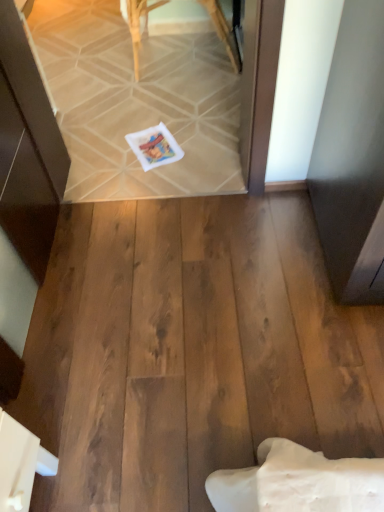
This screenshot has height=512, width=384. I want to click on white matte postcard at center, so click(x=154, y=146).

Image resolution: width=384 pixels, height=512 pixels. Describe the element at coordinates (154, 146) in the screenshot. I see `white matte postcard at center` at that location.

Measure the distance between point (x=226, y=48) and camera.

Point (x=226, y=48) and camera are 2.39 meters apart.

Consider the image. Measure the distance between wooden chair at upper center and camera.

The distance of wooden chair at upper center from camera is 7.65 feet.

Locate an element on the screen. The width and height of the screenshot is (384, 512). wooden chair at upper center is located at coordinates (138, 22).

What do you see at coordinates (138, 22) in the screenshot? The image size is (384, 512). I see `wooden chair at upper center` at bounding box center [138, 22].

At what (x,y) coordinates should I click in order to perform the action: click on white matte postcard at center. Please return your answer as a coordinate pair (x, y). The height and width of the screenshot is (512, 384). Looking at the image, I should click on (154, 146).

Is white matte postcard at center to the right of wooden chair at upper center from the viewer's perspective?

No.

Which object is further away from the camera, white matte postcard at center or wooden chair at upper center?

wooden chair at upper center.

Is point (167, 130) less distant than point (211, 10)?

Yes, it is.

From the image's perspective, is white matte postcard at center under wooden chair at upper center?

Yes, from the image's perspective, white matte postcard at center is beneath wooden chair at upper center.

From a real-world perspective, is white matte postcard at center above or below wooden chair at upper center?

In terms of real-world spatial position, white matte postcard at center is below wooden chair at upper center.

Considering the relative sizes of white matte postcard at center and wooden chair at upper center in the image provided, is white matte postcard at center thinner than wooden chair at upper center?

Yes.

Which of these two, white matte postcard at center or wooden chair at upper center, stands shorter?

white matte postcard at center.

In terms of size, does white matte postcard at center appear bigger or smaller than wooden chair at upper center?

Considering their sizes, white matte postcard at center takes up less space than wooden chair at upper center.

Is wooden chair at upper center inside white matte postcard at center?

Definitely not — wooden chair at upper center is not inside white matte postcard at center.

Is white matte postcard at center far from wooden chair at upper center?

That's not correct — white matte postcard at center is a little close to wooden chair at upper center.

Is white matte postcard at center oriented away from wooden chair at upper center?

That's not correct — white matte postcard at center is not looking away from wooden chair at upper center.

How many degrees apart are the facing directions of white matte postcard at center and wooden chair at upper center?

They differ by 21.6 degrees in their facing directions.

This screenshot has width=384, height=512. I want to click on postcard in front of the wooden chair at upper center, so click(154, 146).

Visually, is wooden chair at upper center positioned to the left or to the right of white matte postcard at center?

wooden chair at upper center is positioned on white matte postcard at center's right side.

Is wooden chair at upper center in front of white matte postcard at center?

No, wooden chair at upper center is further to the viewer.

Is point (146, 17) farther from viewer compared to point (155, 145)?

Yes, point (146, 17) is farther from viewer.

Based on the photo, from the image's perspective, is wooden chair at upper center positioned above or below white matte postcard at center?

From the image's perspective, wooden chair at upper center appears above white matte postcard at center.

From a real-world perspective, relative to white matte postcard at center, is wooden chair at upper center vertically above or below?

Clearly, from a real-world perspective, wooden chair at upper center is above white matte postcard at center.

Which of these two, wooden chair at upper center or white matte postcard at center, is thinner?

white matte postcard at center.

From their relative heights in the image, would you say wooden chair at upper center is taller or shorter than white matte postcard at center?

Considering their sizes, wooden chair at upper center has more height than white matte postcard at center.

Does wooden chair at upper center have a larger size compared to white matte postcard at center?

Indeed, wooden chair at upper center has a larger size compared to white matte postcard at center.

Is wooden chair at upper center not within white matte postcard at center?

That's correct, wooden chair at upper center is outside of white matte postcard at center.

Is wooden chair at upper center far from white matte postcard at center?

That's not correct — wooden chair at upper center is a little close to white matte postcard at center.

Is wooden chair at upper center turned away from white matte postcard at center?

No, white matte postcard at center is not at the back of wooden chair at upper center.

How many degrees apart are the facing directions of wooden chair at upper center and white matte postcard at center?

21.6 degrees separate the facing orientations of wooden chair at upper center and white matte postcard at center.

This screenshot has width=384, height=512. Find the location of `furniture above the white matte postcard at center (from a real-world perspective)`. furniture above the white matte postcard at center (from a real-world perspective) is located at coordinates (138, 22).

What are the coordinates of `furniture located on the right of white matte postcard at center` in the screenshot? It's located at (138, 22).

In the image, there is a wooden chair at upper center. Where is `postcard below it (from a real-world perspective)`? Image resolution: width=384 pixels, height=512 pixels. postcard below it (from a real-world perspective) is located at coordinates (154, 146).